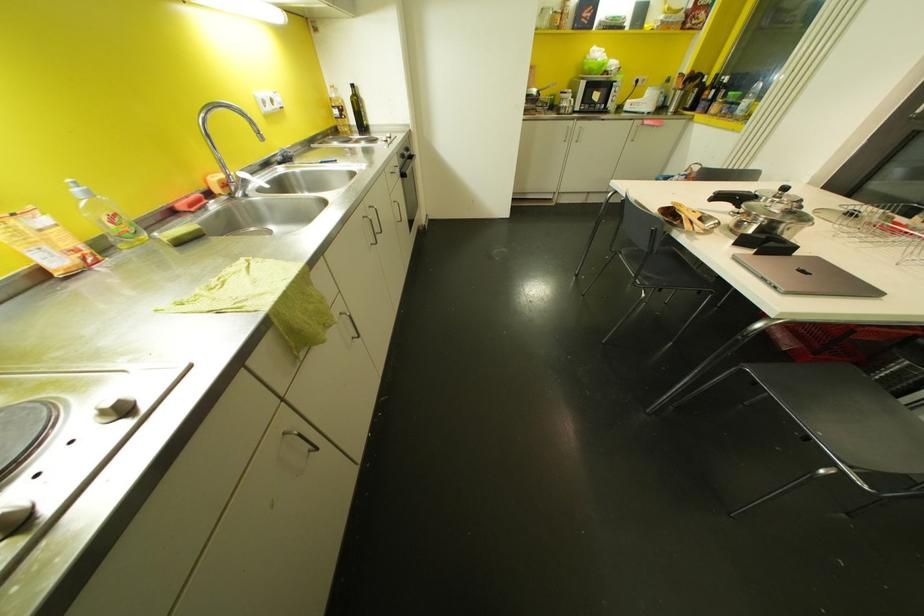
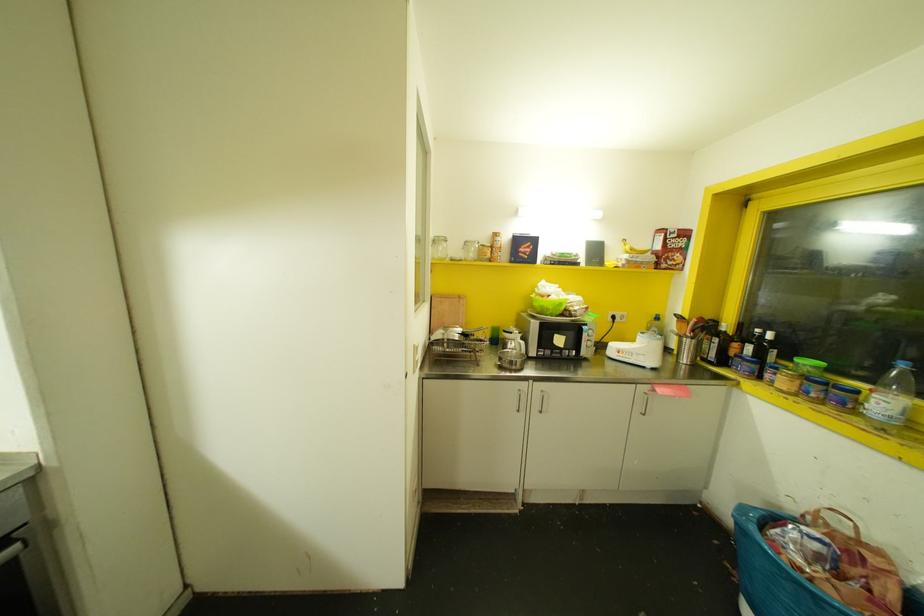
Where in the second image is the point corresponding to (x=706, y=92) from the first image?

(735, 345)